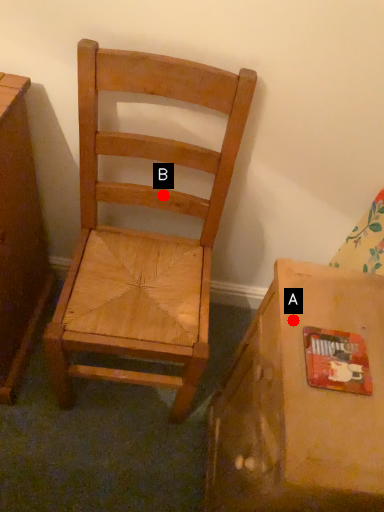
Question: Two points are circled on the image, labeled by A and B beside each circle. Which point is farther from the camera taking this photo?

Choices:
 (A) A is further
 (B) B is further

Answer: (B)